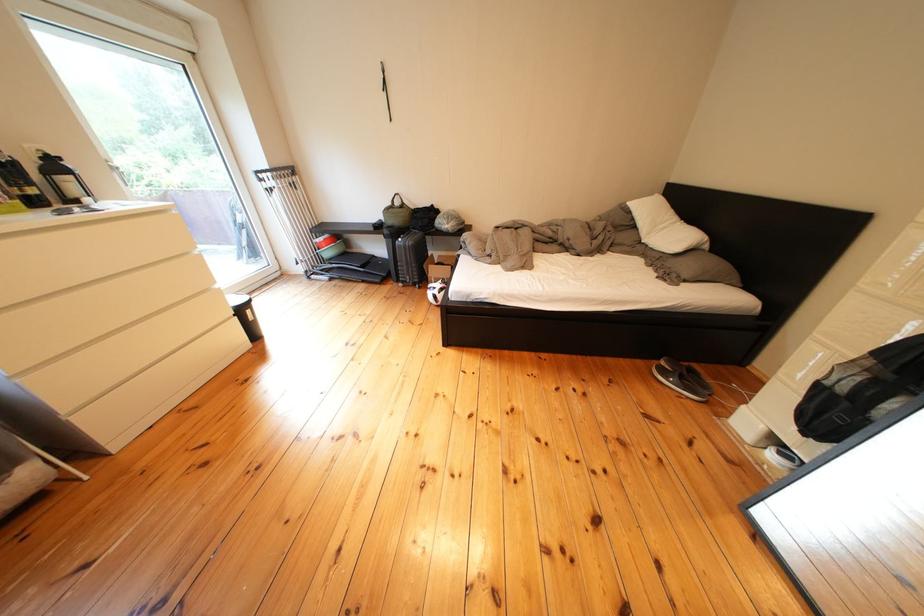
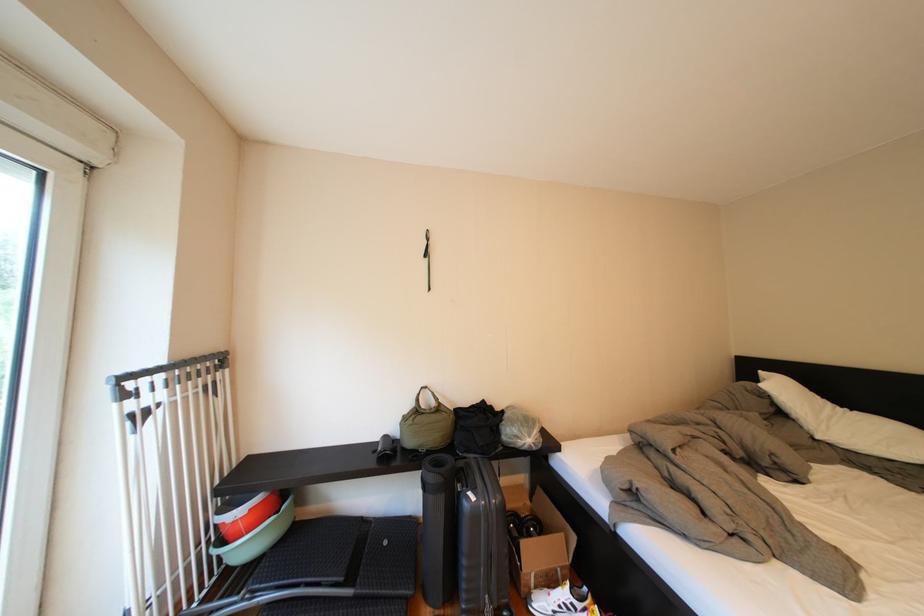
In the second image, find the point that corresponds to pixel 445 290 in the first image.

(554, 609)